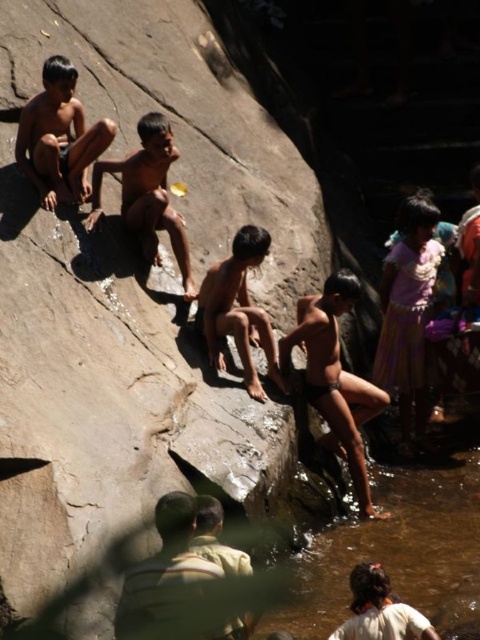
Is pink fabric skirt at lower right positioned in front of light brown skin boy at left?

No, pink fabric skirt at lower right is further to the viewer.

Can you confirm if pink fabric skirt at lower right is shorter than light brown skin boy at left?

Yes.

Is point (422, 275) farther from viewer compared to point (62, 92)?

Yes, it is behind point (62, 92).

Locate an element on the screen. The image size is (480, 640). pink fabric skirt at lower right is located at coordinates (408, 312).

Does matte skin child at center appear on the right side of light brown skin boy at center?

Indeed, matte skin child at center is positioned on the right side of light brown skin boy at center.

Is matte skin child at center thinner than light brown skin boy at center?

Yes, matte skin child at center is thinner than light brown skin boy at center.

The height and width of the screenshot is (640, 480). What do you see at coordinates (335, 378) in the screenshot?
I see `matte skin child at center` at bounding box center [335, 378].

I want to click on matte skin child at center, so click(335, 378).

Which is more to the right, light brown skin boy at left or light brown skin boy at center?

Positioned to the right is light brown skin boy at center.

Who is more distant from viewer, (x=73, y=141) or (x=132, y=166)?

Positioned behind is point (x=73, y=141).

Is point (60, 96) more distant than point (165, 205)?

No, it is in front of (165, 205).

Image resolution: width=480 pixels, height=640 pixels. Find the location of `light brown skin boy at left`. light brown skin boy at left is located at coordinates (59, 138).